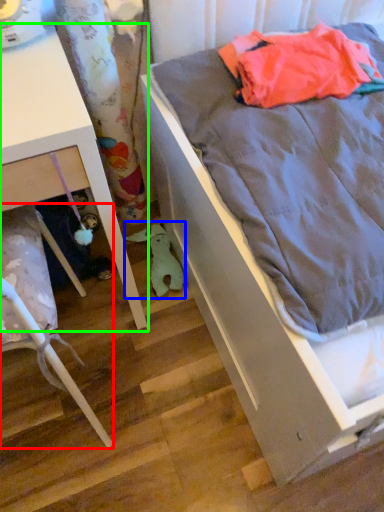
Question: Which object is the closest to the furniture (highlighted by a red box)? Choose among these: stuff (highlighted by a blue box) or furniture (highlighted by a green box).

Choices:
 (A) stuff
 (B) furniture

Answer: (B)